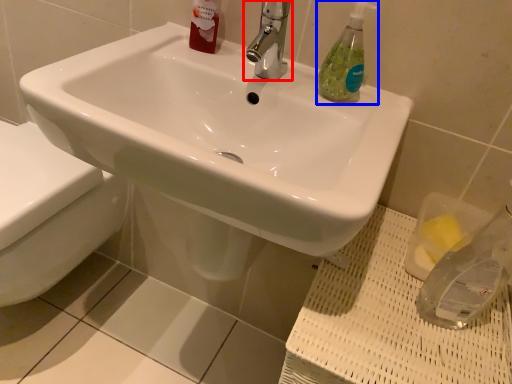
Question: Which of the following is the farthest to the observer, tap (highlighted by a red box) or soap dispenser (highlighted by a blue box)?

Choices:
 (A) tap
 (B) soap dispenser

Answer: (B)